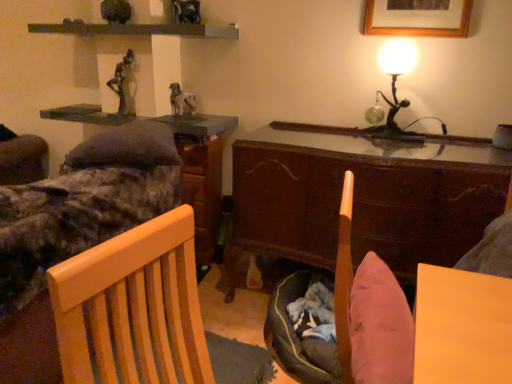
What are the coordinates of `vacant space to the right of furry white dog at center` in the screenshot? It's located at (211, 115).